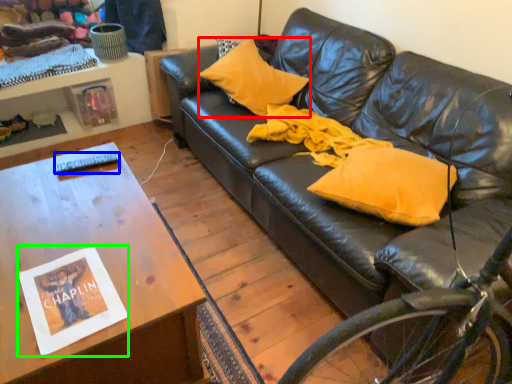
Question: Which object is the closest to the pillow (highlighted by a red box)? Choose among these: remote control (highlighted by a blue box) or magazine (highlighted by a green box).

Choices:
 (A) remote control
 (B) magazine

Answer: (A)